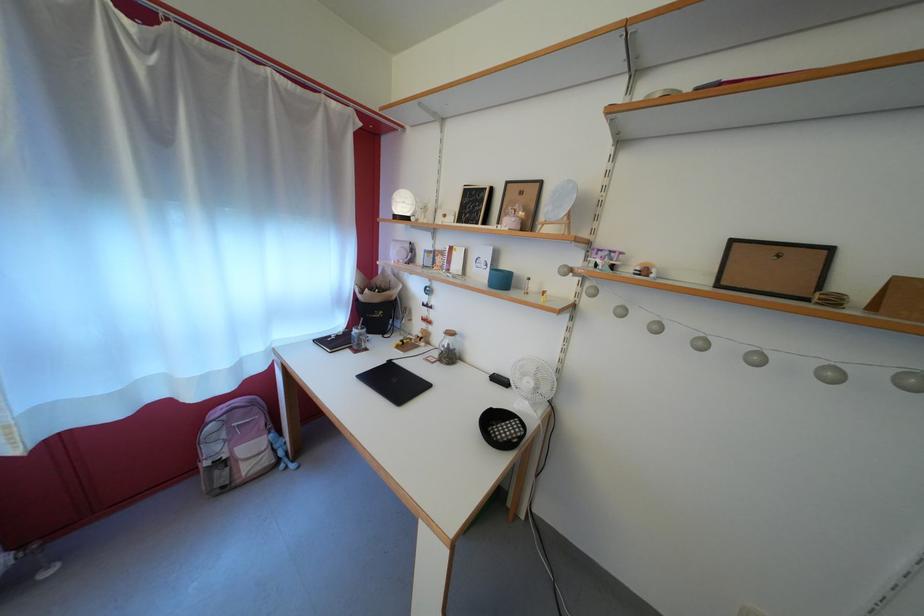
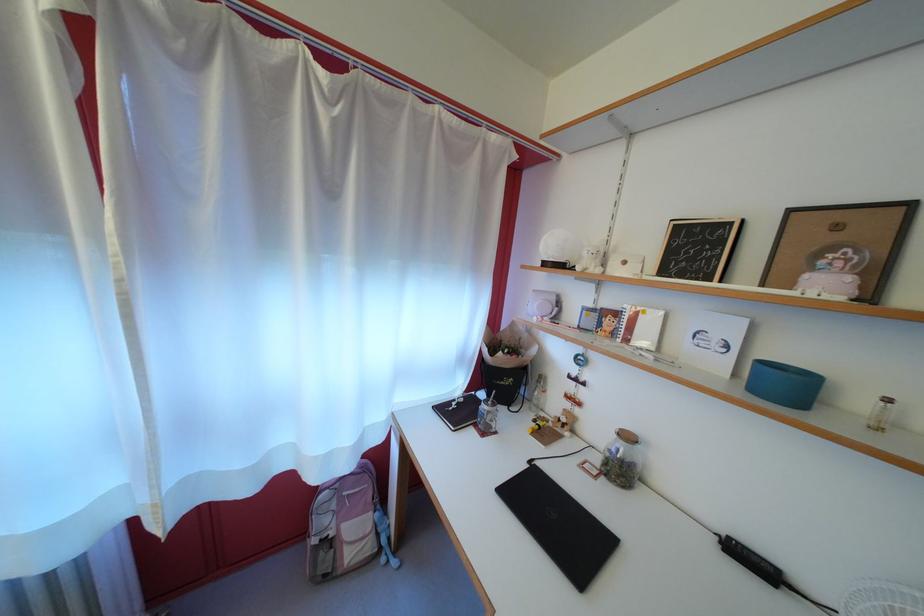
The point at (x=290, y=472) is marked in the first image. Where is the corresponding point in the second image?

(392, 565)